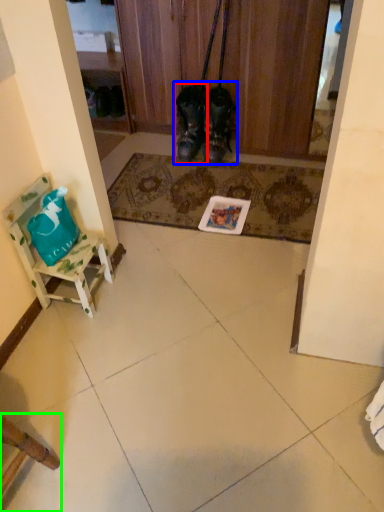
Question: Which object is positioned farthest from footwear (highlighted by a red box)? Select from footwear (highlighted by a blue box) and chair (highlighted by a green box).

Choices:
 (A) footwear
 (B) chair

Answer: (B)